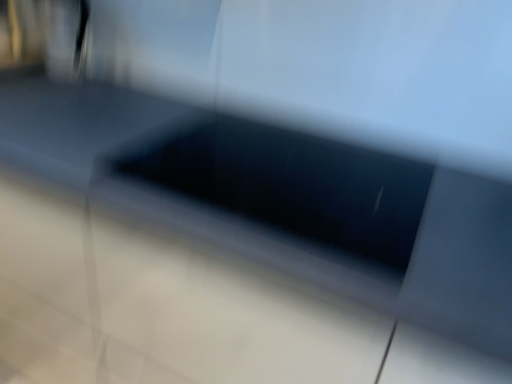
In order to face black glossy sink at center, should I rotate leftwards or rightwards?

To face it directly, rotate right by 4.510 degrees.

Locate an element on the screen. black glossy sink at center is located at coordinates (x=283, y=200).

This screenshot has height=384, width=512. What do you see at coordinates (283, 200) in the screenshot?
I see `black glossy sink at center` at bounding box center [283, 200].

You are a GUI agent. You are given a task and a screenshot of the screen. Output one action in this format:
    pyautogui.click(x=<x>, y=<y>)
    Task: Click on the black glossy sink at center
    The image size is (512, 384).
    Given the screenshot: What is the action you would take?
    pyautogui.click(x=283, y=200)